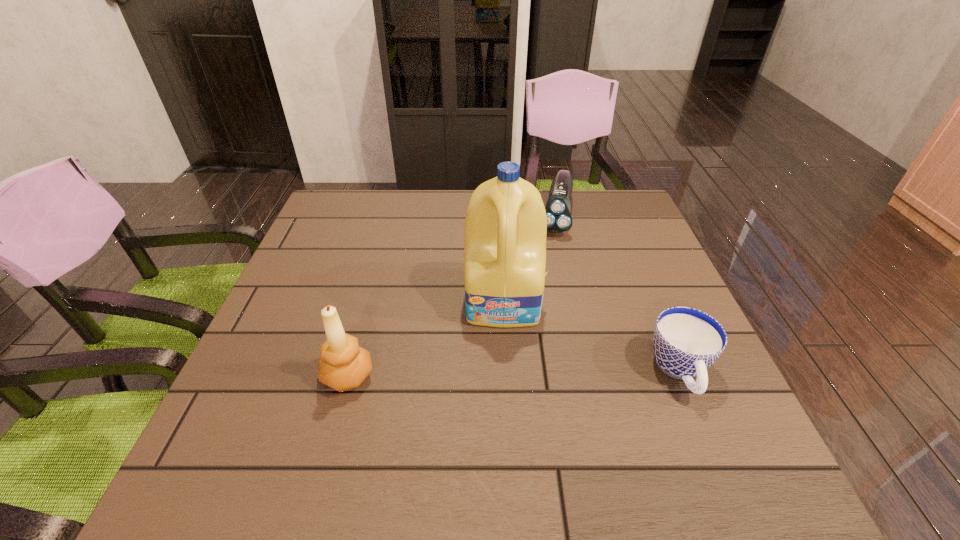
Identify the location of the leftmost object. This screenshot has height=540, width=960. (343, 366).

Where is `candle_holder`? The image size is (960, 540). candle_holder is located at coordinates (343, 366).

Identify the location of cup. The image size is (960, 540). (686, 342).

This screenshot has width=960, height=540. I want to click on the tallest object, so click(506, 224).

Locate an element on the screen. the second farthest object is located at coordinates (506, 224).

Where is `the second object from right to left`? the second object from right to left is located at coordinates (558, 207).

I want to click on the farthest object, so click(558, 207).

You are a GUI agent. You are given a task and a screenshot of the screen. Output one action in this format:
    pyautogui.click(x=<x>, y=<y>)
    Task: Click on the free point located on the back of the leftmost object
    
    Given the screenshot: What is the action you would take?
    pyautogui.click(x=364, y=320)

I want to click on free space located on the label of the detergent, so click(506, 414).

The height and width of the screenshot is (540, 960). I want to click on vacant region located on the label of the detergent, so click(506, 419).